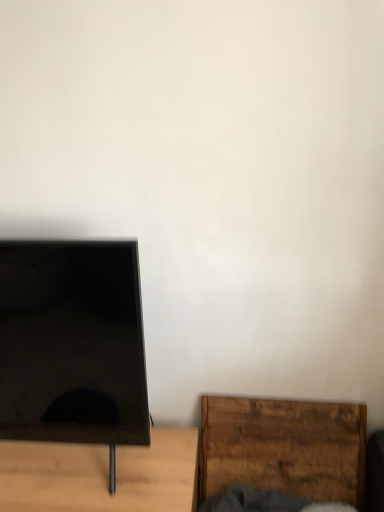
Question: Is black glossy screen at left taller than wooden cutting board at lower right, positioned as the first furniture in right-to-left order?

Choices:
 (A) yes
 (B) no

Answer: (A)

Question: Does black glossy screen at left appear on the left side of wooden cutting board at lower right, positioned as the first furniture in right-to-left order?

Choices:
 (A) no
 (B) yes

Answer: (B)

Question: Considering the relative sizes of black glossy screen at left and wooden cutting board at lower right, the 2th furniture viewed from the left, in the image provided, is black glossy screen at left thinner than wooden cutting board at lower right, the 2th furniture viewed from the left,?

Choices:
 (A) no
 (B) yes

Answer: (A)

Question: From the image's perspective, is black glossy screen at left on wooden cutting board at lower right, positioned as the first furniture in right-to-left order?

Choices:
 (A) yes
 (B) no

Answer: (A)

Question: Is black glossy screen at left turned away from wooden cutting board at lower right, the 2th furniture viewed from the left?

Choices:
 (A) yes
 (B) no

Answer: (B)

Question: From a real-world perspective, relative to wooden cutting board at lower right, the 2th furniture viewed from the left, is black matte tv stand at left, positioned as the 2th furniture in right-to-left order, vertically above or below?

Choices:
 (A) below
 (B) above

Answer: (A)

Question: From the image's perspective, is black matte tv stand at left, the first furniture viewed from the left, located above or below wooden cutting board at lower right, the 2th furniture viewed from the left?

Choices:
 (A) above
 (B) below

Answer: (B)

Question: In the image, is black matte tv stand at left, the first furniture viewed from the left, on the left side or the right side of wooden cutting board at lower right, positioned as the first furniture in right-to-left order?

Choices:
 (A) left
 (B) right

Answer: (A)

Question: In terms of width, does black matte tv stand at left, the first furniture viewed from the left, look wider or thinner when compared to wooden cutting board at lower right, the 2th furniture viewed from the left?

Choices:
 (A) thin
 (B) wide

Answer: (B)

Question: From the image's perspective, is black glossy screen at left positioned above or below black matte tv stand at left, positioned as the 2th furniture in right-to-left order?

Choices:
 (A) above
 (B) below

Answer: (A)

Question: From a real-world perspective, is black glossy screen at left above or below black matte tv stand at left, positioned as the 2th furniture in right-to-left order?

Choices:
 (A) above
 (B) below

Answer: (A)

Question: Choose the correct answer: Is black glossy screen at left inside black matte tv stand at left, the first furniture viewed from the left, or outside it?

Choices:
 (A) outside
 (B) inside

Answer: (A)

Question: Would you say black glossy screen at left is to the left or to the right of black matte tv stand at left, the first furniture viewed from the left, in the picture?

Choices:
 (A) right
 (B) left

Answer: (B)

Question: In terms of width, does black matte tv stand at left, the first furniture viewed from the left, look wider or thinner when compared to black glossy screen at left?

Choices:
 (A) wide
 (B) thin

Answer: (A)

Question: Does point (122, 465) appear closer or farther from the camera than point (104, 288)?

Choices:
 (A) closer
 (B) farther

Answer: (B)